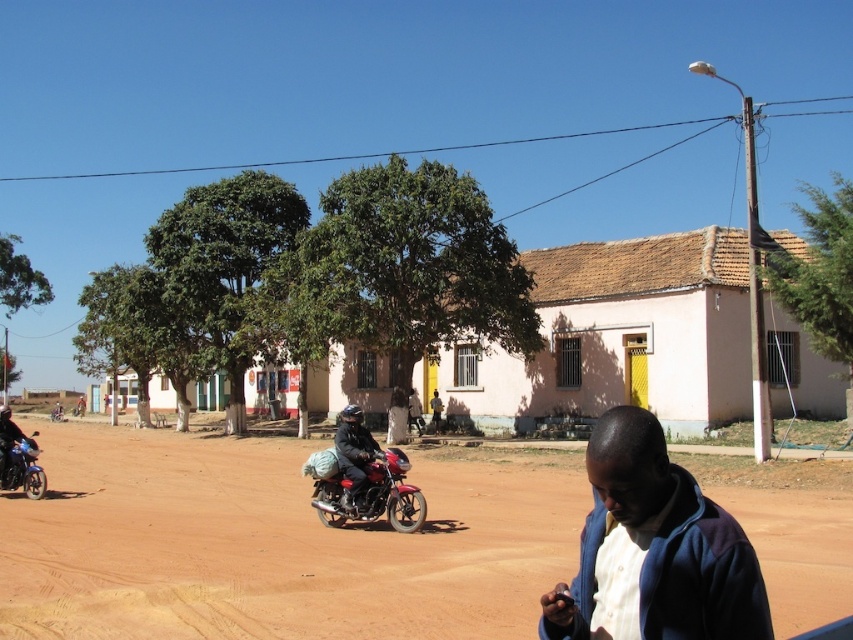
You are a photographer wanting to capture both the blue fabric jacket at lower right and the shiny red motorcycle at center in the same frame. Based on their positions, will you need to adjust your camera angle to include both?

The blue fabric jacket at lower right is closer to the viewer than the shiny red motorcycle at center, so you will need to adjust your camera angle to include both in the same frame.

You are a photographer trying to capture the shiny red motorcycle at center and the blue fabric jacket at lower right in a single shot. Considering their sizes in the frame, which object will appear smaller in the photo?

The blue fabric jacket at lower right will appear smaller in the photo because it occupies less space than the shiny red motorcycle at center.

You are a delivery person who needs to place a 10 feet long package on the ground between the brown dirt field at center and the metallic blue motorbike at left. Is there enough space to place it without moving either object?

The distance between the brown dirt field at center and the metallic blue motorbike at left is 25.08 feet, which is more than enough to place a 10 feet long package between them without moving either object.